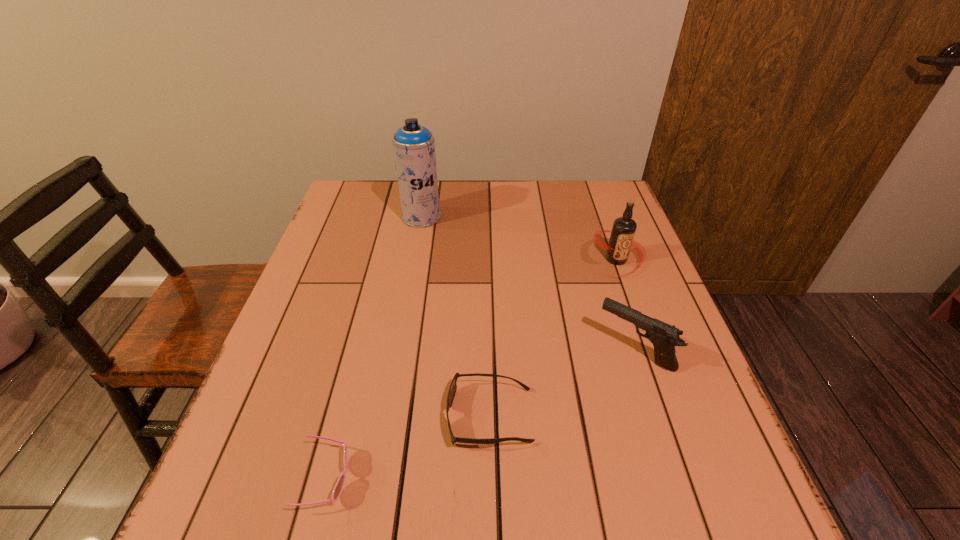
Locate an element on the screen. Image resolution: width=960 pixels, height=540 pixels. the third closest object to the second farthest object is located at coordinates (413, 144).

Where is `the third closest object to the third farthest object`? the third closest object to the third farthest object is located at coordinates (338, 488).

Locate an element on the screen. free space that satisfies the following two spatial constraints: 1. on the label of the root beer; 2. on the front-facing side of the left sunglasses is located at coordinates (695, 479).

At what (x,y) coordinates should I click in order to perform the action: click on free space that satisfies the following two spatial constraints: 1. on the front side of the aerosol can; 2. on the front-facing side of the left sunglasses. Please return your answer as a coordinate pair (x, y). Looking at the image, I should click on (375, 479).

Find the location of a particular element. vacant point that satisfies the following two spatial constraints: 1. on the label of the root beer; 2. on the front-facing side of the left sunglasses is located at coordinates (695, 479).